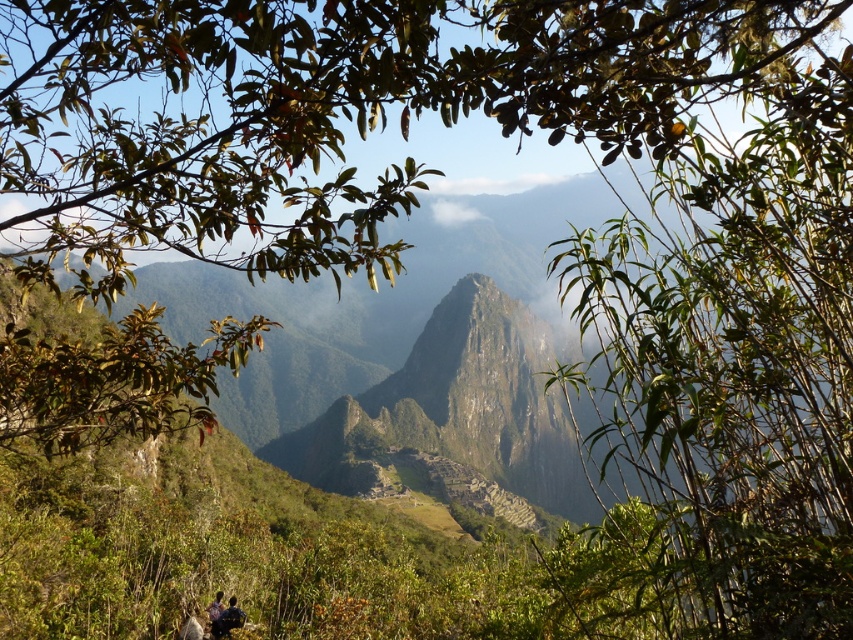
Question: Can you confirm if dark blue shirt at lower left is positioned above dark brown hair at lower left?

Choices:
 (A) no
 (B) yes

Answer: (B)

Question: Which of the following is the closest to the observer?

Choices:
 (A) dark brown hair at lower left
 (B) dark blue shirt at lower left

Answer: (A)

Question: Is dark blue shirt at lower left to the right of dark brown hair at lower left from the viewer's perspective?

Choices:
 (A) yes
 (B) no

Answer: (A)

Question: Is dark blue shirt at lower left smaller than dark brown hair at lower left?

Choices:
 (A) yes
 (B) no

Answer: (B)